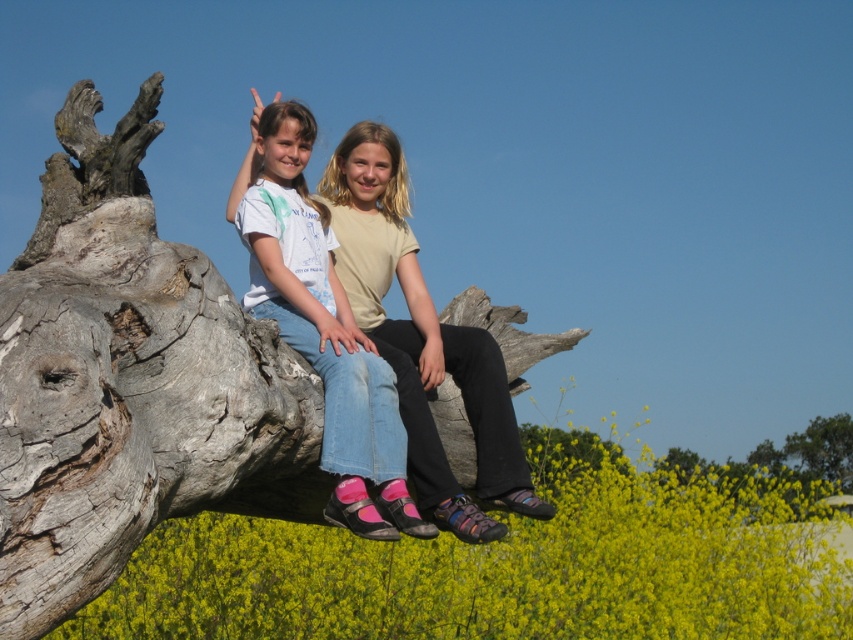
Describe the element at coordinates (131, 381) in the screenshot. I see `gray rough tree trunk at center` at that location.

Who is higher up, gray rough tree trunk at center or light beige cotton shirt at center?

light beige cotton shirt at center

Where is `gray rough tree trunk at center`? gray rough tree trunk at center is located at coordinates (131, 381).

Where is `gray rough tree trunk at center`? The image size is (853, 640). gray rough tree trunk at center is located at coordinates (131, 381).

Which is more to the right, denim jeans at center or green leafy tree at upper right?

Positioned to the right is green leafy tree at upper right.

Is denim jeans at center taller than green leafy tree at upper right?

Yes, denim jeans at center is taller than green leafy tree at upper right.

Locate an element on the screen. Image resolution: width=853 pixels, height=640 pixels. denim jeans at center is located at coordinates pos(322,326).

Does point (276, 508) come closer to viewer compared to point (325, 433)?

No, (276, 508) is further to viewer.

Is point (149, 356) closer to camera compared to point (300, 348)?

Yes, it is.

Find the location of a particular element. The image size is (853, 640). gray rough tree trunk at center is located at coordinates (131, 381).